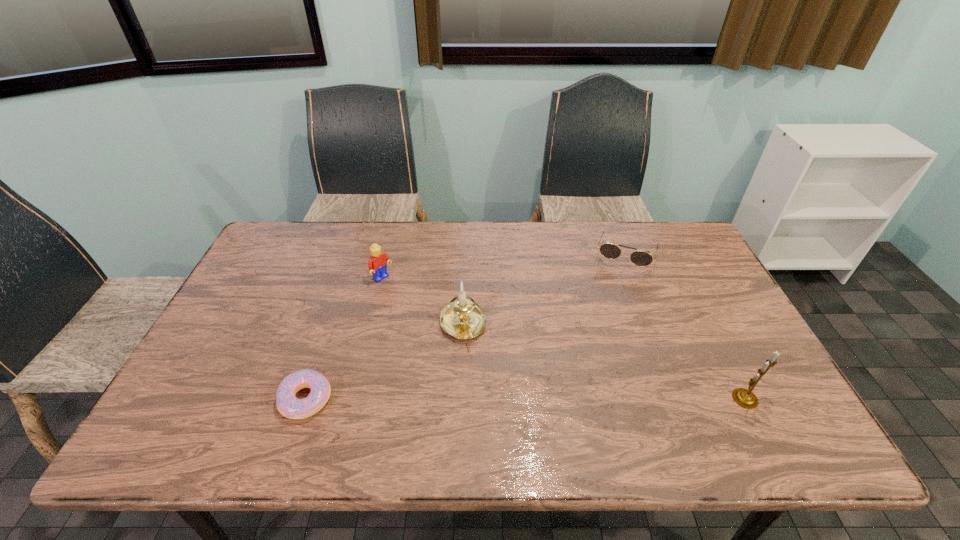
In order to click on the leftmost object in this screenshot , I will do `click(290, 406)`.

Where is `the shortest object`? This screenshot has height=540, width=960. the shortest object is located at coordinates (290, 406).

At what (x,y) coordinates should I click in order to perform the action: click on the right candle holder. Please return your answer as a coordinate pair (x, y). Looking at the image, I should click on (745, 398).

The image size is (960, 540). I want to click on the fourth tallest object, so click(610, 251).

Where is `Lego`? Lego is located at coordinates (378, 261).

At what (x,y) coordinates should I click in order to perform the action: click on the third tallest object. Please return your answer as a coordinate pair (x, y). The image size is (960, 540). Looking at the image, I should click on (378, 261).

You are a GUI agent. You are given a task and a screenshot of the screen. Output one action in this format:
    pyautogui.click(x=<x>, y=<y>)
    Task: Click on the shorter candle holder
    The image size is (960, 540).
    Given the screenshot: What is the action you would take?
    pyautogui.click(x=462, y=318)

Identify the location of the left candle holder. (462, 318).

This screenshot has height=540, width=960. I want to click on free space located on the right of the doughnut, so click(462, 399).

This screenshot has height=540, width=960. Identify the location of free spot located on the back of the right candle holder. (729, 367).